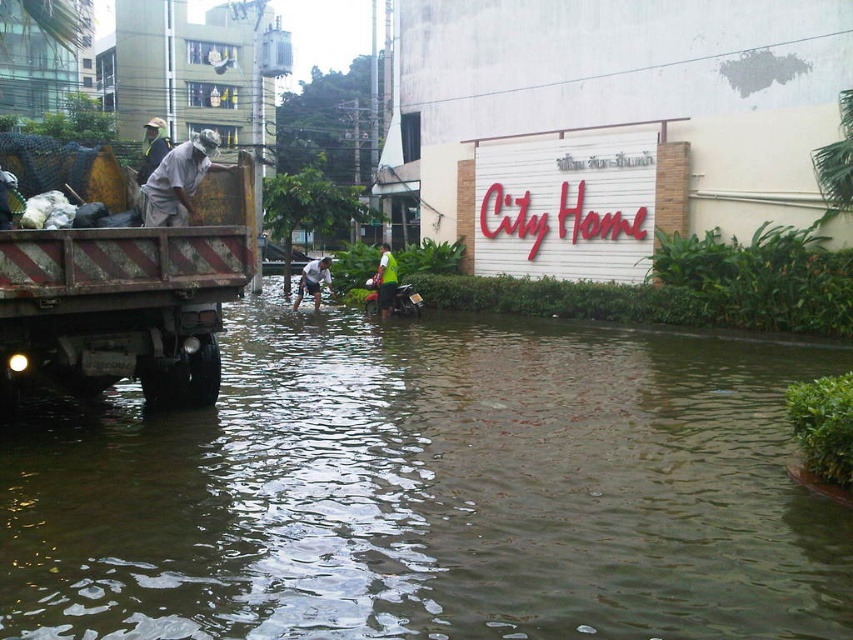
Question: Can you confirm if brown murky water at lower center is thinner than green reflective vest at center?

Choices:
 (A) yes
 (B) no

Answer: (B)

Question: Which point is farther from the camera taking this photo?

Choices:
 (A) (184, 163)
 (B) (296, 308)
 (C) (753, 540)

Answer: (B)

Question: Is matte black helmet at upper left thinner than green reflective vest at center?

Choices:
 (A) yes
 (B) no

Answer: (B)

Question: Is rusty metal truck at left below matte black helmet at upper left?

Choices:
 (A) no
 (B) yes

Answer: (B)

Question: Which object is positioned closest to the rusty metal truck at left?

Choices:
 (A) matte black helmet at upper left
 (B) brown murky water at lower center
 (C) green reflective vest at center
 (D) white fabric shirt at center

Answer: (B)

Question: Among these points, which one is nearest to the camera?

Choices:
 (A) (231, 179)
 (B) (300, 273)

Answer: (A)